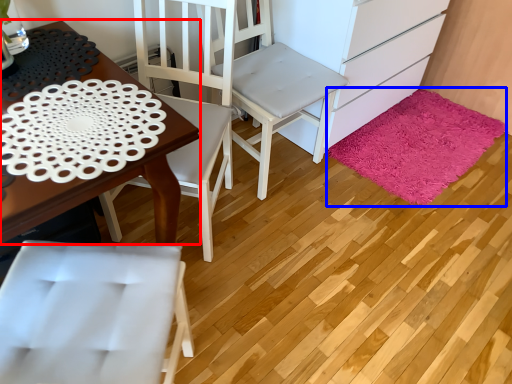
Question: Which point is closer to the camera, desk (highlighted by a red box) or mat (highlighted by a blue box)?

Choices:
 (A) desk
 (B) mat

Answer: (A)